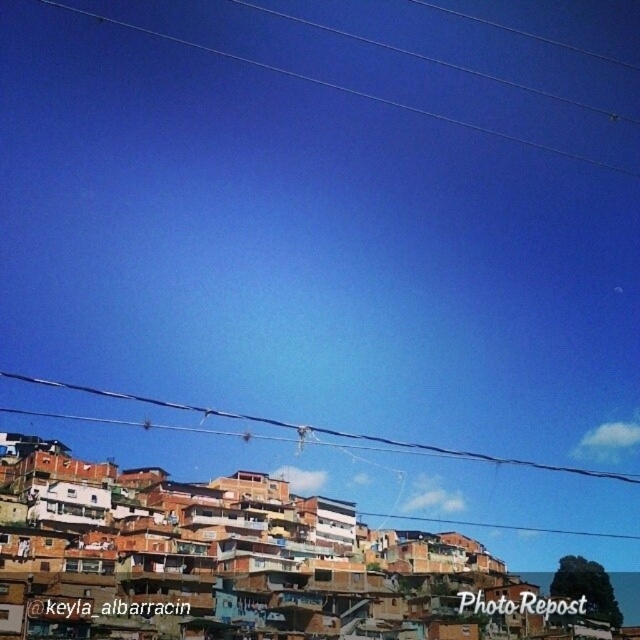
Question: Based on their relative distances, which object is farther from the black wire at upper center?

Choices:
 (A) clear plastic wires at upper center
 (B) brown wooden houses at lower center

Answer: (B)

Question: Does brown wooden houses at lower center have a larger size compared to black wire at upper center?

Choices:
 (A) yes
 (B) no

Answer: (A)

Question: Is black wire at upper center wider than clear plastic wires at upper center?

Choices:
 (A) yes
 (B) no

Answer: (A)

Question: Which point is farther to the camera?

Choices:
 (A) (506, 138)
 (B) (61, 384)
 (C) (344, 506)

Answer: (A)

Question: From the image, what is the correct spatial relationship of brown wooden houses at lower center in relation to black wire at upper center?

Choices:
 (A) right
 (B) left

Answer: (A)

Question: Which of the following is the farthest from the observer?

Choices:
 (A) brown wooden houses at lower center
 (B) black wire at upper center
 (C) clear plastic wires at upper center

Answer: (C)